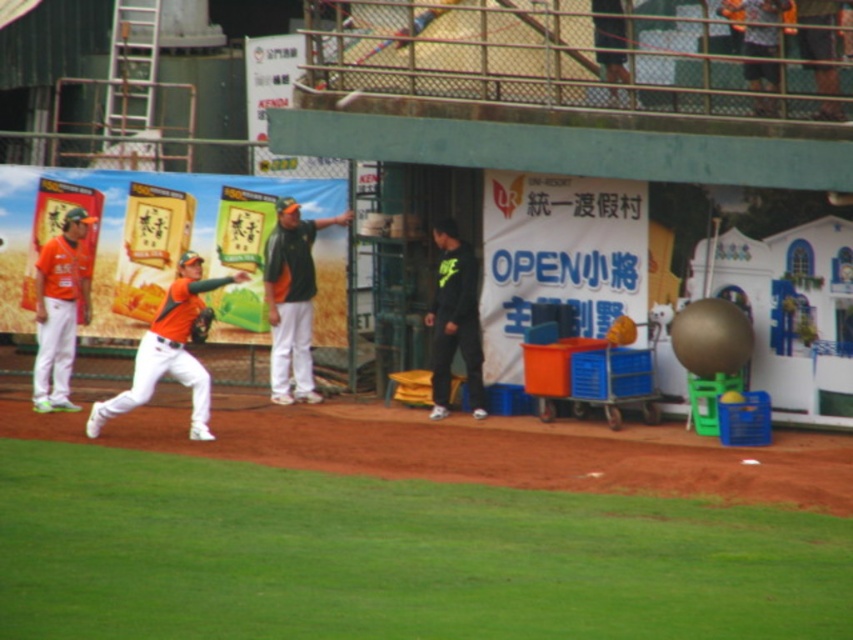
Question: Among these points, which one is farthest from the camera?

Choices:
 (A) (36, 266)
 (B) (173, 372)

Answer: (A)

Question: Which object appears closest to the camera in this image?

Choices:
 (A) black matte pants at center
 (B) orange jersey at left
 (C) orange fabric baseball glove at center
 (D) orange jersey at center

Answer: (C)

Question: Which point is farther to the camera?

Choices:
 (A) orange jersey at center
 (B) orange fabric baseball glove at center
 (C) orange matte baseball glove at center

Answer: (A)

Question: Can you confirm if orange jersey at center is bigger than orange matte baseball glove at center?

Choices:
 (A) yes
 (B) no

Answer: (B)

Question: Does orange jersey at center have a larger size compared to black matte pants at center?

Choices:
 (A) yes
 (B) no

Answer: (A)

Question: Does black matte pants at center appear on the left side of orange fabric baseball glove at center?

Choices:
 (A) yes
 (B) no

Answer: (B)